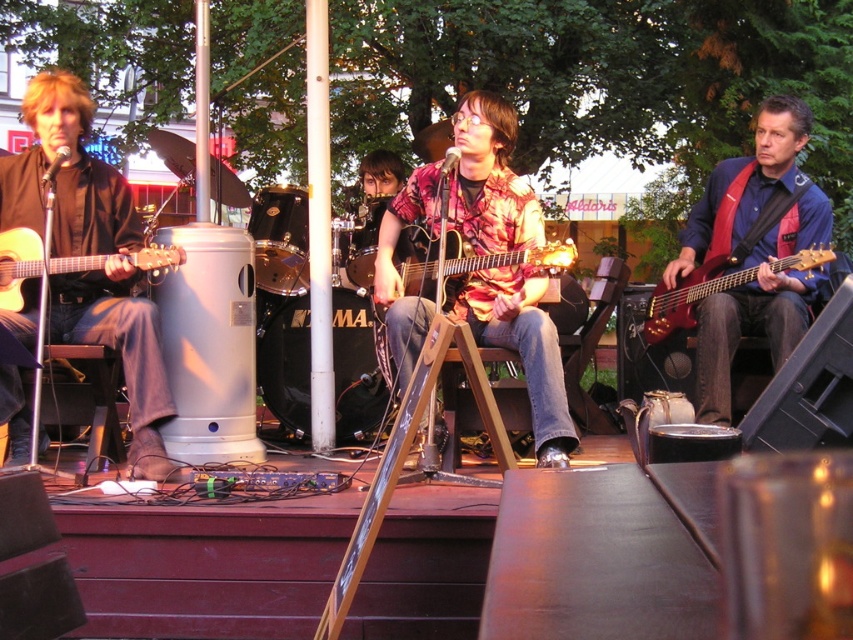
You are a stagehand setting up for a concert. You notice the shiny red guitar at right and the wooden acoustic guitar at center. Which guitar is placed higher on the stage?

The shiny red guitar at right is positioned over the wooden acoustic guitar at center, so it is placed higher on the stage.

You are standing at point A, which is at coordinates point (74, 202), and you want to walk to point B at coordinates point (102, 262). Which direction should you move to reach point B from point A?

To reach point B from point A, you should move forward since point A is behind point B according to the coordinates provided.